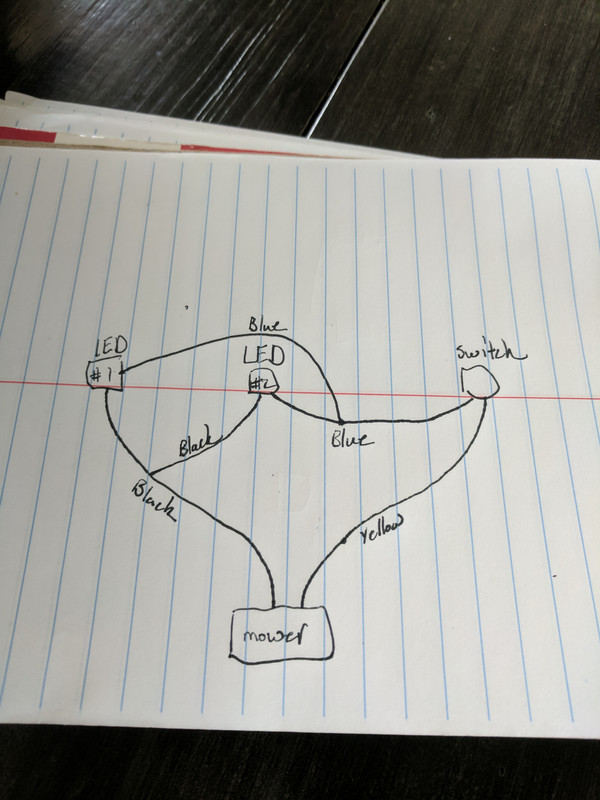
At what (x,y) coordinates should I click in order to perform the action: click on switch. Please return your answer as a coordinate pair (x, y). Looking at the image, I should click on (474, 349).